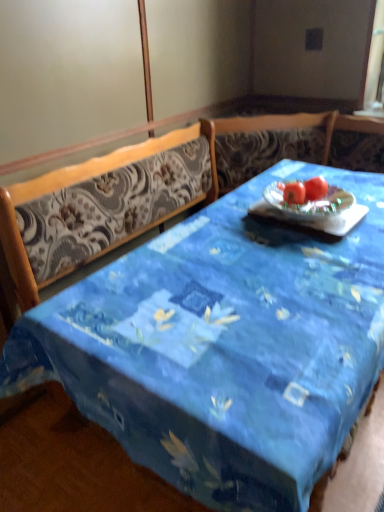
This screenshot has width=384, height=512. Describe the element at coordinates (315, 188) in the screenshot. I see `red matte tomato at center` at that location.

Locate an element on the screen. The height and width of the screenshot is (512, 384). red matte tomato at center is located at coordinates (315, 188).

The height and width of the screenshot is (512, 384). What are the coordinates of `blue fabric table at center` in the screenshot? It's located at (224, 348).

Image resolution: width=384 pixels, height=512 pixels. I want to click on red matte tomato at center, so click(x=315, y=188).

Is red matte tomato at center behind red matte tomato at center?

No, red matte tomato at center is closer to the camera.

Are red matte tomato at center and red matte tomato at center far apart?

Actually, red matte tomato at center and red matte tomato at center are a little close together.

In terms of size, does red matte tomato at center appear bigger or smaller than red matte tomato at center?

Clearly, red matte tomato at center is larger in size than red matte tomato at center.

Does red matte tomato at center have a lesser height compared to red matte tomato at center?

Correct, red matte tomato at center is not as tall as red matte tomato at center.

From a real-world perspective, which is physically above, blue fabric table at center or red matte tomato at center?

Result: red matte tomato at center.

Does blue fabric table at center turn towards red matte tomato at center?

No, blue fabric table at center does not turn towards red matte tomato at center.

Is blue fabric table at center further to camera compared to red matte tomato at center?

That is False.

Is red matte tomato at center spatially inside blue fabric table at center, or outside of it?

red matte tomato at center can be found inside blue fabric table at center.

From the image's perspective, is red matte tomato at center below blue fabric table at center?

No, from the image's perspective, red matte tomato at center is not beneath blue fabric table at center.

Looking at their sizes, would you say red matte tomato at center is wider or thinner than blue fabric table at center?

Considering their sizes, red matte tomato at center looks slimmer than blue fabric table at center.

Considering the sizes of red matte tomato at center and blue fabric table at center in the image, is red matte tomato at center bigger or smaller than blue fabric table at center?

Clearly, red matte tomato at center is smaller in size than blue fabric table at center.

From the image's perspective, who appears lower, blue fabric table at center or red matte tomato at center?

From the image's view, blue fabric table at center is below.

Consider the image. Considering the sizes of objects blue fabric table at center and red matte tomato at center in the image provided, who is bigger, blue fabric table at center or red matte tomato at center?

Bigger between the two is blue fabric table at center.

Which object is further away from the camera, blue fabric table at center or red matte tomato at center?

red matte tomato at center is further away from the camera.

Considering the sizes of red matte tomato at center and blue fabric table at center in the image, is red matte tomato at center bigger or smaller than blue fabric table at center?

In the image, red matte tomato at center appears to be smaller than blue fabric table at center.

I want to click on fruit above the blue fabric table at center (from the image's perspective), so click(x=304, y=190).

Is red matte tomato at center completely or partially outside of blue fabric table at center?

No, red matte tomato at center is not outside of blue fabric table at center.

Is red matte tomato at center facing towards red matte tomato at center?

No, red matte tomato at center is not turned towards red matte tomato at center.

Based on the photo, in terms of width, does red matte tomato at center look wider or thinner when compared to red matte tomato at center?

Clearly, red matte tomato at center has less width compared to red matte tomato at center.

From a real-world perspective, which is physically above, red matte tomato at center or red matte tomato at center?

In real-world perspective, red matte tomato at center is above.

Locate an element on the screen. The image size is (384, 512). tomato to the right of red matte tomato at center is located at coordinates (315, 188).

The width and height of the screenshot is (384, 512). What are the coordinates of `tomato above the blue fabric table at center (from the image's perspective)` in the screenshot? It's located at (315, 188).

Which object lies nearer to the anchor point blue fabric table at center, red matte tomato at center or red matte tomato at center?

red matte tomato at center is closer to blue fabric table at center.

Considering their positions, is red matte tomato at center positioned closer to blue fabric table at center than red matte tomato at center?

red matte tomato at center lies closer to blue fabric table at center than the other object.

Considering their positions, is red matte tomato at center positioned closer to red matte tomato at center than blue fabric table at center?

Based on the image, red matte tomato at center appears to be nearer to red matte tomato at center.

When comparing their distances from red matte tomato at center, does blue fabric table at center or red matte tomato at center seem closer?

The object closer to red matte tomato at center is red matte tomato at center.

Considering their positions, is blue fabric table at center positioned closer to red matte tomato at center than red matte tomato at center?

The object closer to red matte tomato at center is red matte tomato at center.

Estimate the real-world distances between objects in this image. Which object is further from red matte tomato at center, red matte tomato at center or blue fabric table at center?

blue fabric table at center is further to red matte tomato at center.

Locate an element on the screen. The height and width of the screenshot is (512, 384). fruit between blue fabric table at center and red matte tomato at center in the front-back direction is located at coordinates (304, 190).